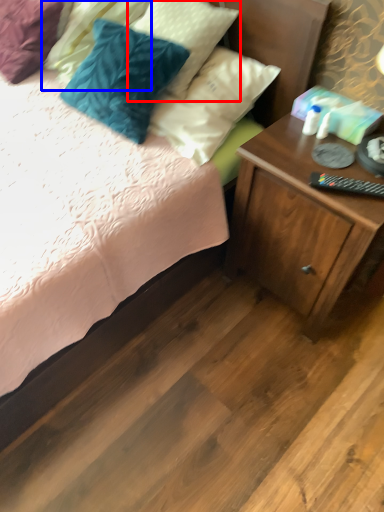
Question: Which point is closer to the camera, pillow (highlighted by a red box) or pillow (highlighted by a blue box)?

Choices:
 (A) pillow
 (B) pillow

Answer: (A)